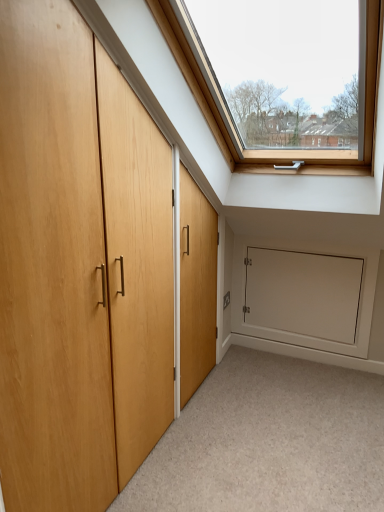
Question: Is white matte door at lower right at the back of carpeted floor at lower center?

Choices:
 (A) yes
 (B) no

Answer: (B)

Question: Can you confirm if carpeted floor at lower center is positioned to the left of white matte door at lower right?

Choices:
 (A) no
 (B) yes

Answer: (B)

Question: Is carpeted floor at lower center not close to white matte door at lower right?

Choices:
 (A) no
 (B) yes

Answer: (A)

Question: Is carpeted floor at lower center placed right next to white matte door at lower right?

Choices:
 (A) yes
 (B) no

Answer: (B)

Question: Can you confirm if carpeted floor at lower center is smaller than white matte door at lower right?

Choices:
 (A) no
 (B) yes

Answer: (A)

Question: Considering the positions of white matte door at lower right and light wood door at left in the image, is white matte door at lower right bigger or smaller than light wood door at left?

Choices:
 (A) big
 (B) small

Answer: (B)

Question: From a real-world perspective, relative to light wood door at left, is white matte door at lower right vertically above or below?

Choices:
 (A) below
 (B) above

Answer: (A)

Question: Do you think white matte door at lower right is within light wood door at left, or outside of it?

Choices:
 (A) inside
 (B) outside

Answer: (B)

Question: Does point (281, 298) appear closer or farther from the camera than point (19, 18)?

Choices:
 (A) farther
 (B) closer

Answer: (A)

Question: From a real-world perspective, is light wood door at left positioned above or below white matte door at lower right?

Choices:
 (A) below
 (B) above

Answer: (B)

Question: Is point (11, 158) positioned closer to the camera than point (291, 283)?

Choices:
 (A) farther
 (B) closer

Answer: (B)

Question: In terms of height, does light wood door at left look taller or shorter compared to white matte door at lower right?

Choices:
 (A) short
 (B) tall

Answer: (B)

Question: Visually, is light wood door at left positioned to the left or to the right of white matte door at lower right?

Choices:
 (A) left
 (B) right

Answer: (A)

Question: From the image's perspective, relative to carpeted floor at lower center, is light wood door at left above or below?

Choices:
 (A) above
 (B) below

Answer: (A)

Question: Which is correct: light wood door at left is inside carpeted floor at lower center, or outside of it?

Choices:
 (A) outside
 (B) inside

Answer: (A)